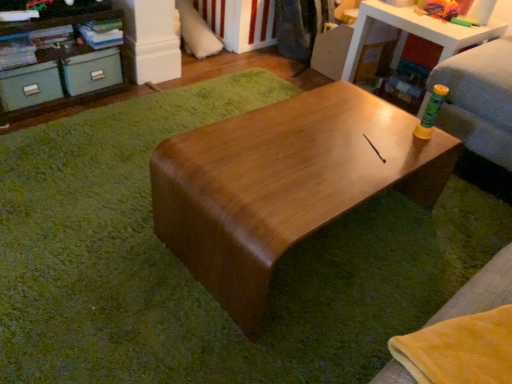
Where is `unoccupied region to the right of matte green drawer at left, the first drawer positioned from the left`? The height and width of the screenshot is (384, 512). unoccupied region to the right of matte green drawer at left, the first drawer positioned from the left is located at coordinates (79, 117).